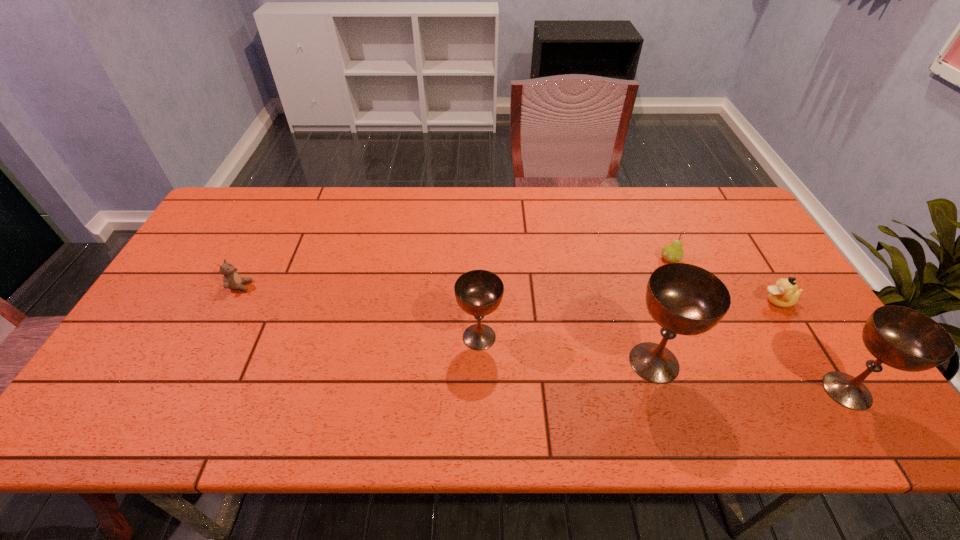
Find the location of a particular element. This screenshot has height=540, width=960. the leftmost chalice is located at coordinates (479, 293).

The height and width of the screenshot is (540, 960). Identify the location of the fifth object from right to left. (479, 293).

What are the coordinates of `the second chalice from left to right` in the screenshot? It's located at (684, 299).

The height and width of the screenshot is (540, 960). What are the coordinates of `the rightmost chalice` in the screenshot? It's located at (902, 338).

The width and height of the screenshot is (960, 540). What are the coordinates of `the second tallest chalice` in the screenshot? It's located at (902, 338).

Locate an element on the screen. the farthest object is located at coordinates (672, 253).

You are a GUI agent. You are given a task and a screenshot of the screen. Output one action in this format:
    pyautogui.click(x=<x>, y=<y>)
    Task: Click on the third object from right to left
    
    Given the screenshot: What is the action you would take?
    pyautogui.click(x=672, y=253)

At what (x,y) coordinates should I click in order to perform the action: click on teddy bear. Please return your answer as a coordinate pair (x, y). Image resolution: width=960 pixels, height=540 pixels. Looking at the image, I should click on (232, 280).

Where is `duckling`? This screenshot has height=540, width=960. duckling is located at coordinates (784, 293).

Identify the location of free location located 0.250m on the right of the leftmost chalice. Image resolution: width=960 pixels, height=540 pixels. (599, 337).